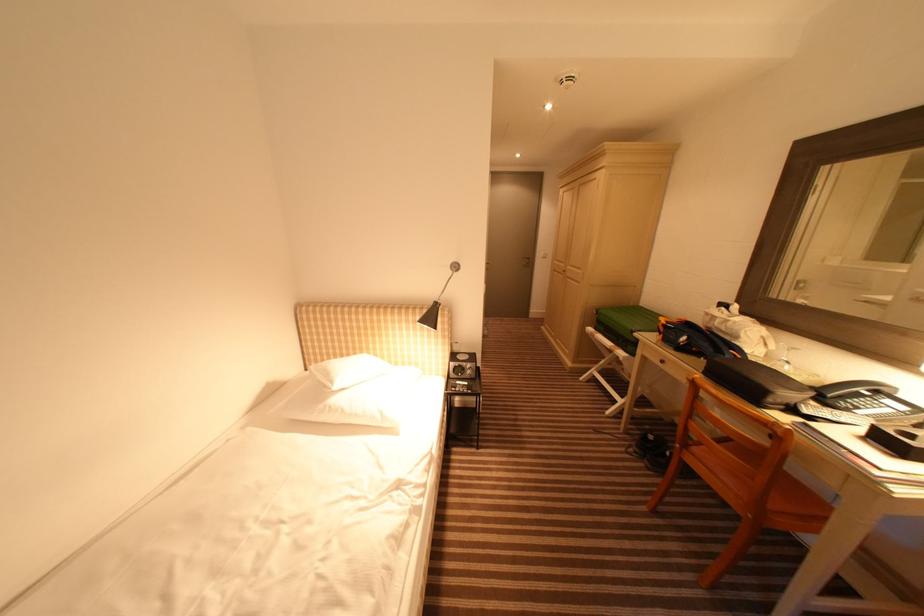
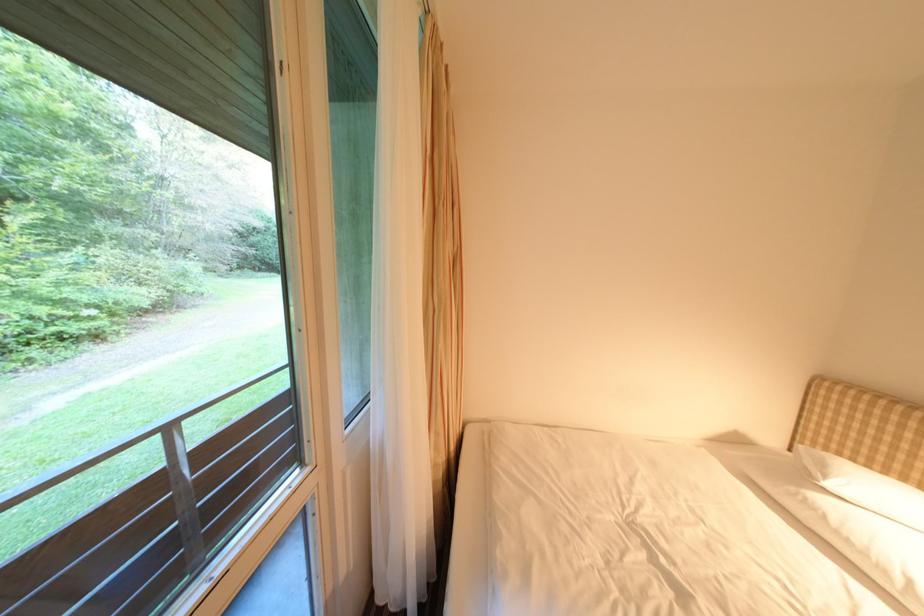
Question: The camera is either moving clockwise (left) or counter-clockwise (right) around the object. The first image is from the beginning of the video and the second image is from the end. Is the camera moving left or right when shooting the video?

Choices:
 (A) Left
 (B) Right

Answer: (B)